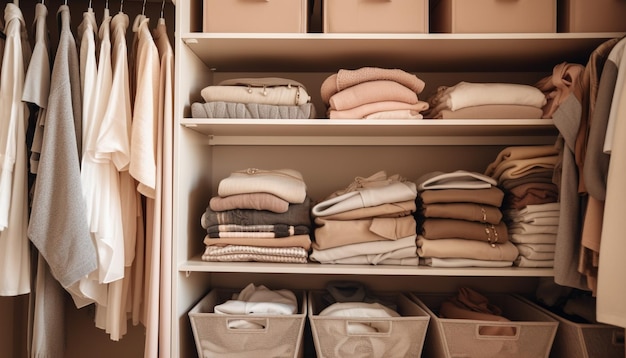
At what (x,y) coordinates should I click in order to perform the action: click on clothes folded on shelves in the center. Please return your answer as a coordinate pair (x, y). Looking at the image, I should click on (376, 72), (381, 88), (386, 104), (386, 112), (377, 189), (379, 206), (381, 223), (382, 243), (381, 254), (392, 259).